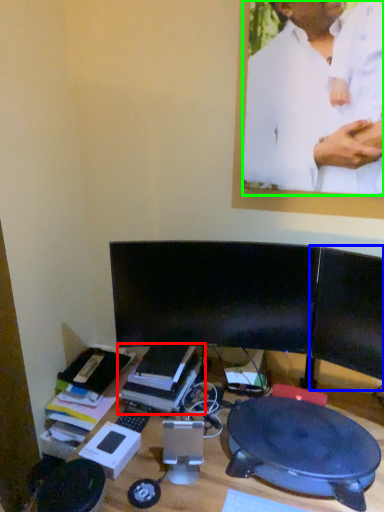
Question: Which is nearer to the book (highlighted by a red box)? computer monitor (highlighted by a blue box) or man (highlighted by a green box).

Choices:
 (A) computer monitor
 (B) man

Answer: (A)